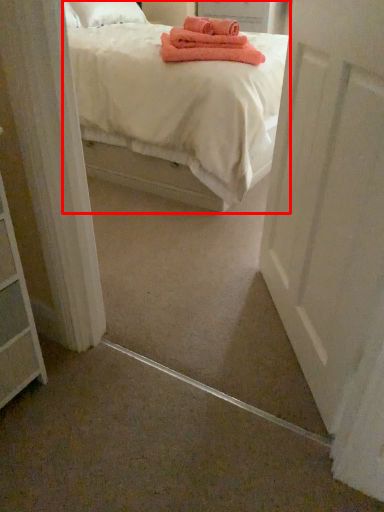
Question: From the image, what is the correct spatial relationship of bed (annotated by the red box) in relation to door?

Choices:
 (A) left
 (B) right

Answer: (A)